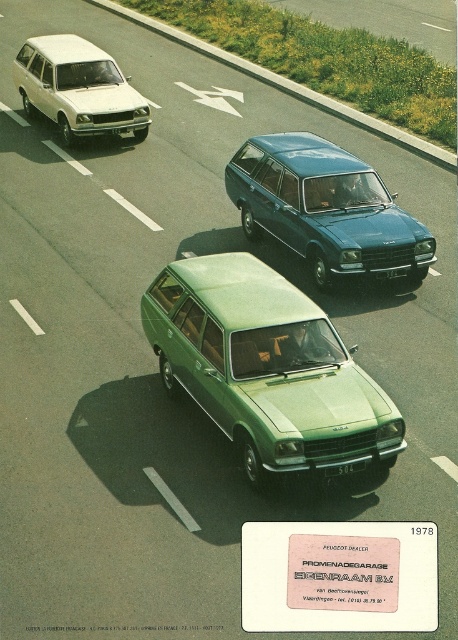
Question: Which object is positioned farthest from the green matte station wagon at center?

Choices:
 (A) teal metallic station wagon at center
 (B) matte white station wagon at upper left

Answer: (B)

Question: Is teal metallic station wagon at center above matte white station wagon at upper left?

Choices:
 (A) yes
 (B) no

Answer: (B)

Question: Which of the following is the farthest from the observer?

Choices:
 (A) teal metallic station wagon at center
 (B) green matte station wagon at center
 (C) matte white station wagon at upper left

Answer: (C)

Question: Considering the real-world distances, which object is farthest from the green matte station wagon at center?

Choices:
 (A) matte white station wagon at upper left
 (B) teal metallic station wagon at center

Answer: (A)

Question: Does teal metallic station wagon at center have a lesser width compared to matte white station wagon at upper left?

Choices:
 (A) yes
 (B) no

Answer: (A)

Question: Does teal metallic station wagon at center lie in front of matte white station wagon at upper left?

Choices:
 (A) yes
 (B) no

Answer: (A)